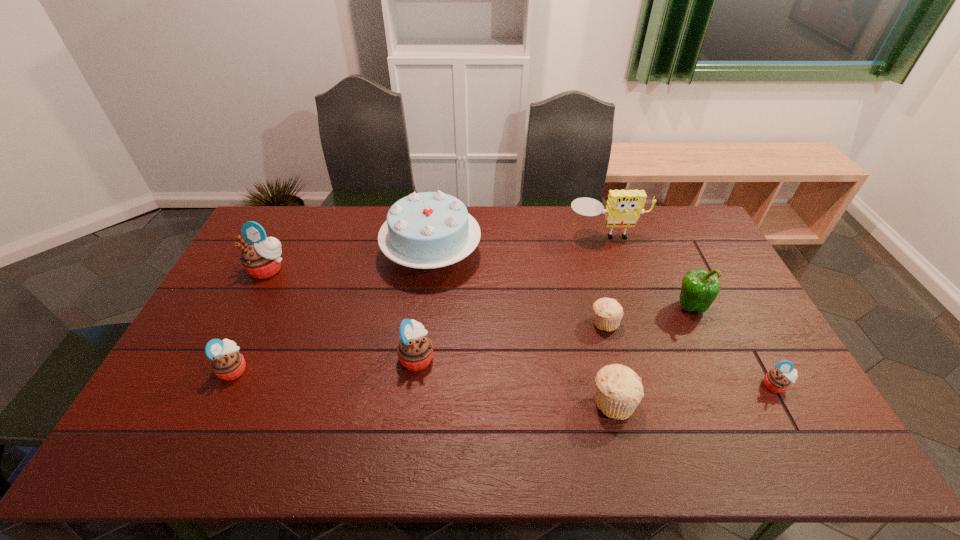
Find the location of a particular element. free space that is in between the farthest muffin and the birthday cake is located at coordinates (349, 261).

What are the coordinates of `vacant area between the tallest muffin and the farther beige muffin` in the screenshot? It's located at (437, 296).

Locate an element on the screen. Image resolution: width=960 pixels, height=540 pixels. object that is the fourth closest to the second smallest pink muffin is located at coordinates coord(619,390).

Locate which object ranks sixth in proximity to the birthday cake. Please provide its 2D coordinates. Your answer should be formatted as a tuple, i.e. [(x, y)], where the tuple contains the x and y coordinates of a point satisfying the conditions above.

[(619, 390)]

At what (x,y) coordinates should I click in order to perform the action: click on muffin that is the second nearest to the fourth muffin from right to left. Please return your answer as a coordinate pair (x, y). The height and width of the screenshot is (540, 960). Looking at the image, I should click on (619, 390).

Select which muffin appears as the third closest to the smaller beige muffin. Please provide its 2D coordinates. Your answer should be formatted as a tuple, i.e. [(x, y)], where the tuple contains the x and y coordinates of a point satisfying the conditions above.

[(415, 350)]

Locate which pink muffin ranks third in proximity to the second farthest muffin. Please provide its 2D coordinates. Your answer should be formatted as a tuple, i.e. [(x, y)], where the tuple contains the x and y coordinates of a point satisfying the conditions above.

[(227, 364)]

Select which pink muffin appears as the third closest to the fifth shortest muffin. Please provide its 2D coordinates. Your answer should be formatted as a tuple, i.e. [(x, y)], where the tuple contains the x and y coordinates of a point satisfying the conditions above.

[(778, 380)]

Identify the location of blank area in the image that satisfies the following two spatial constraints: 1. on the front-facing side of the nearer beige muffin; 2. on the left side of the second smallest pink muffin. (218, 402).

At what (x,y) coordinates should I click in order to perform the action: click on vacant region that satisfies the following two spatial constraints: 1. on the front-facing side of the biggest pink muffin; 2. on the right side of the farther beige muffin. Please return your answer as a coordinate pair (x, y). The height and width of the screenshot is (540, 960). Looking at the image, I should click on (242, 322).